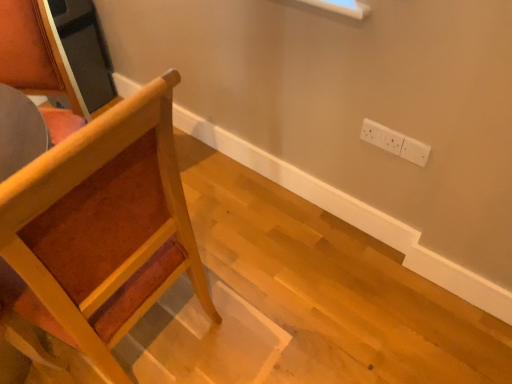
This screenshot has height=384, width=512. What do you see at coordinates (395, 142) in the screenshot? I see `white plastic electric outlet at upper right` at bounding box center [395, 142].

The image size is (512, 384). In order to click on white plastic electric outlet at upper right in this screenshot , I will do `click(395, 142)`.

You are a GUI agent. You are given a task and a screenshot of the screen. Output one action in this format:
    pyautogui.click(x=<x>, y=<y>)
    Task: Click on the wooden chair at left
    
    Given the screenshot: What is the action you would take?
    pyautogui.click(x=101, y=228)

What do you see at coordinates (101, 228) in the screenshot?
I see `wooden chair at left` at bounding box center [101, 228].

I want to click on white plastic electric outlet at upper right, so click(x=395, y=142).

Is white plastic electric outlet at upper right to the right of wooden chair at left from the viewer's perspective?

Yes, white plastic electric outlet at upper right is to the right of wooden chair at left.

Which object is closer to the camera, white plastic electric outlet at upper right or wooden chair at left?

wooden chair at left is more forward.

Does point (397, 143) come behind point (135, 151)?

That is True.

From the image's perspective, between white plastic electric outlet at upper right and wooden chair at left, who is located below?

From the image's view, wooden chair at left is below.

From a real-world perspective, relative to wooden chair at left, is white plastic electric outlet at upper right vertically above or below?

Clearly, from a real-world perspective, white plastic electric outlet at upper right is below wooden chair at left.

Does white plastic electric outlet at upper right have a lesser width compared to wooden chair at left?

Yes.

Is white plastic electric outlet at upper right shorter than wooden chair at left?

Yes, white plastic electric outlet at upper right is shorter than wooden chair at left.

Between white plastic electric outlet at upper right and wooden chair at left, which one has larger size?

Bigger between the two is wooden chair at left.

Looking at this image, could wooden chair at left be considered to be inside white plastic electric outlet at upper right?

No.

Is there a large distance between white plastic electric outlet at upper right and wooden chair at left?

No, white plastic electric outlet at upper right is not far from wooden chair at left.

Is wooden chair at left at the back of white plastic electric outlet at upper right?

No, wooden chair at left is not at the back of white plastic electric outlet at upper right.

How different are the orientations of white plastic electric outlet at upper right and wooden chair at left in degrees?

There is a 87.2-degree angle between the facing directions of white plastic electric outlet at upper right and wooden chair at left.

How far apart are white plastic electric outlet at upper right and wooden chair at left?

A distance of 88.34 centimeters exists between white plastic electric outlet at upper right and wooden chair at left.

Where is `chair below the white plastic electric outlet at upper right (from the image's perspective)`? The height and width of the screenshot is (384, 512). chair below the white plastic electric outlet at upper right (from the image's perspective) is located at coordinates (101, 228).

Is wooden chair at left to the right of white plastic electric outlet at upper right from the viewer's perspective?

No.

Which is in front, wooden chair at left or white plastic electric outlet at upper right?

wooden chair at left is in front.

Considering the positions of points (76, 135) and (369, 139), is point (76, 135) closer to camera compared to point (369, 139)?

That is True.

From the image's perspective, which is below, wooden chair at left or white plastic electric outlet at upper right?

wooden chair at left.

From a real-world perspective, relative to white plastic electric outlet at upper right, is wooden chair at left vertically above or below?

From a real-world perspective, wooden chair at left is physically above white plastic electric outlet at upper right.

Consider the image. Considering the relative sizes of wooden chair at left and white plastic electric outlet at upper right in the image provided, is wooden chair at left wider than white plastic electric outlet at upper right?

Indeed, wooden chair at left has a greater width compared to white plastic electric outlet at upper right.

Is wooden chair at left taller or shorter than white plastic electric outlet at upper right?

In the image, wooden chair at left appears to be taller than white plastic electric outlet at upper right.

Between wooden chair at left and white plastic electric outlet at upper right, which one has smaller size?

white plastic electric outlet at upper right.

Is wooden chair at left spatially inside white plastic electric outlet at upper right, or outside of it?

wooden chair at left exists outside the volume of white plastic electric outlet at upper right.

Would you consider wooden chair at left to be distant from white plastic electric outlet at upper right?

That's not correct — wooden chair at left is a little close to white plastic electric outlet at upper right.

Does wooden chair at left turn towards white plastic electric outlet at upper right?

No, wooden chair at left is not facing towards white plastic electric outlet at upper right.

Can you tell me how much wooden chair at left and white plastic electric outlet at upper right differ in facing direction?

The angular difference between wooden chair at left and white plastic electric outlet at upper right is 87.2 degrees.

How far apart are wooden chair at left and white plastic electric outlet at upper right?

They are 34.78 inches apart.

Where is `electric outlet lying behind the wooden chair at left`? This screenshot has height=384, width=512. electric outlet lying behind the wooden chair at left is located at coordinates (395, 142).

Locate an element on the screen. The image size is (512, 384). electric outlet above the wooden chair at left (from the image's perspective) is located at coordinates (395, 142).

Locate an element on the screen. chair on the left of white plastic electric outlet at upper right is located at coordinates (101, 228).